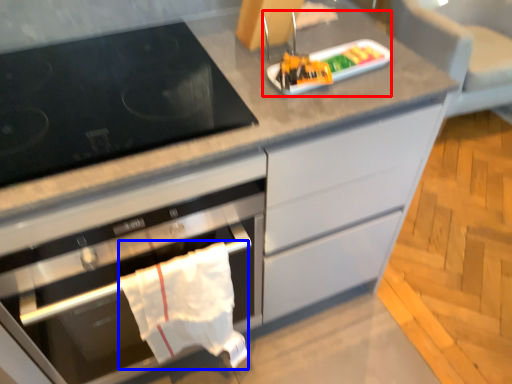
Question: Which object appears farthest to the camera in this image, appliance (highlighted by a red box) or material (highlighted by a blue box)?

Choices:
 (A) appliance
 (B) material

Answer: (A)